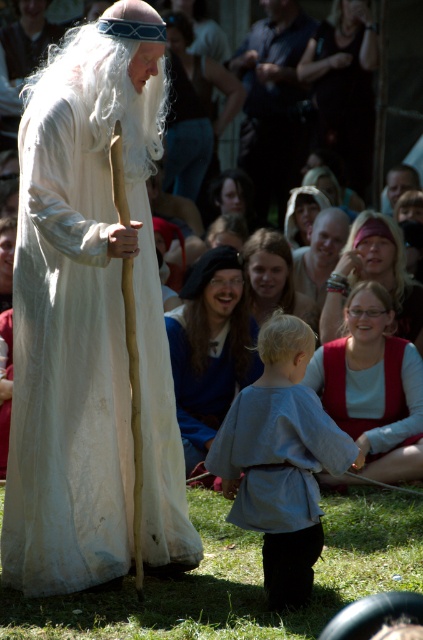
You are a costume designer preparing for a play. You have two fabric pieces available for costumes. The blue fabric at center and the smooth beige shirt at center. The director wants to ensure that the fabric chosen for the main character has enough material to create flowing robes. Which fabric should you select?

The blue fabric at center has a larger width than the smooth beige shirt at center, making it more suitable for creating flowing robes that require ample material.

You are a guest at this medieval event and want to take a photo with the central figure. To ensure the white linen robe at center and the dark fabric handbag at upper center are both visible in your photo, where should you position yourself relative to the central figure?

Position yourself in front of the central figure so that the white linen robe at center is closer to you and the dark fabric handbag at upper center is slightly behind it. This way, both elements will be visible in the photo since the white linen robe at center is closer to the viewer than the dark fabric handbag at upper center.

Where is the blue fabric at center located in the image?

The blue fabric at center is located at point (211, 348).